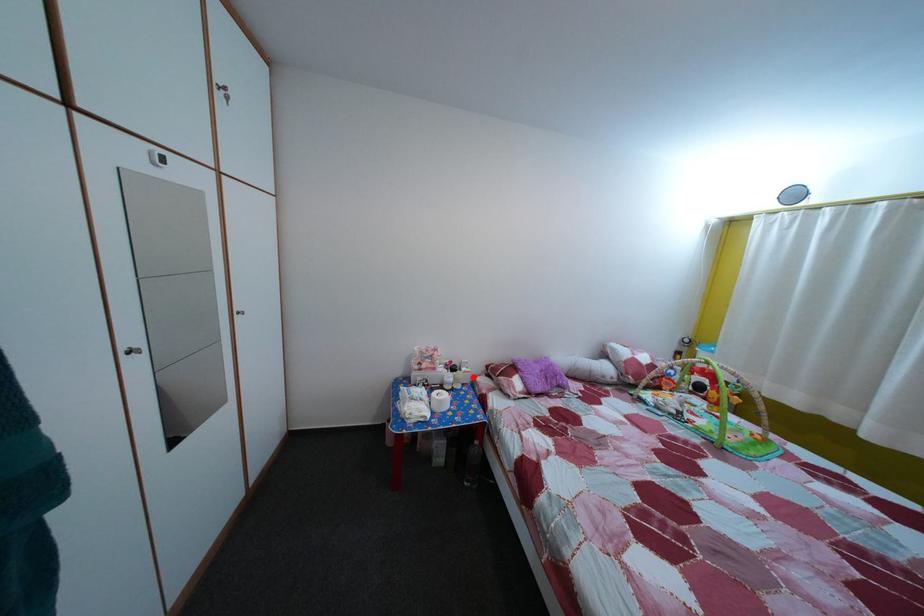
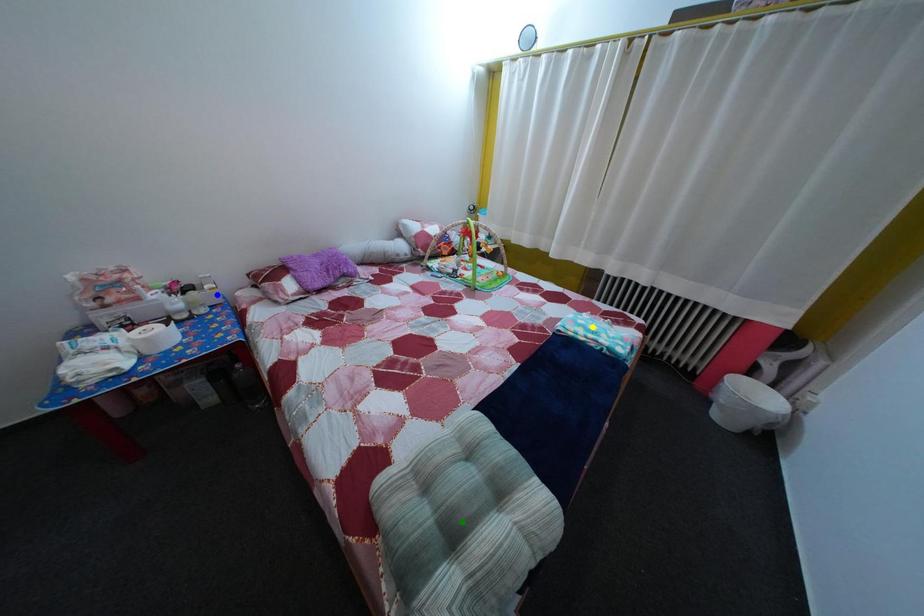
Question: I am providing you with two images of the same scene from different viewpoints. A red point is marked on the first image. You are given multiple points on the second image. Can you choose the point in image 2 that corresponds to the point in image 1?

Choices:
 (A) green point
 (B) yellow point
 (C) blue point

Answer: (C)